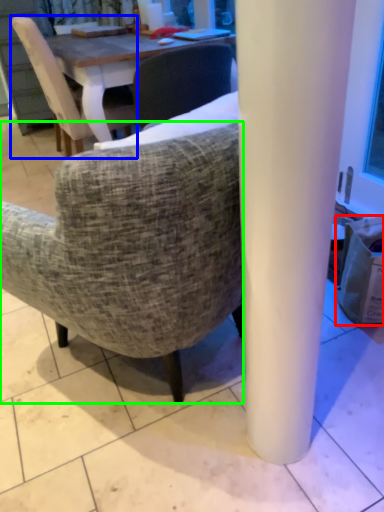
Question: Which object is the closest to the trash bin/can (highlighted by a red box)? Choose among these: chair (highlighted by a blue box) or chair (highlighted by a green box).

Choices:
 (A) chair
 (B) chair

Answer: (B)